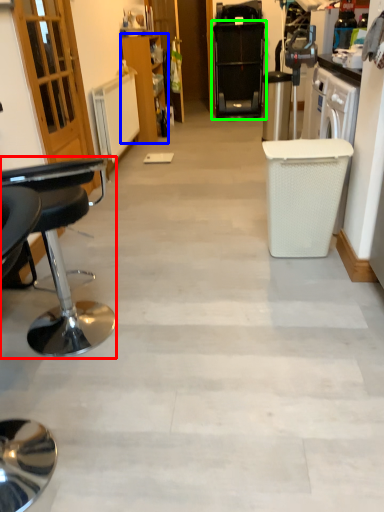
Question: Which object is the closest to the chair (highlighted by a red box)? Choose among these: cabinetry (highlighted by a blue box) or home appliance (highlighted by a green box).

Choices:
 (A) cabinetry
 (B) home appliance

Answer: (A)